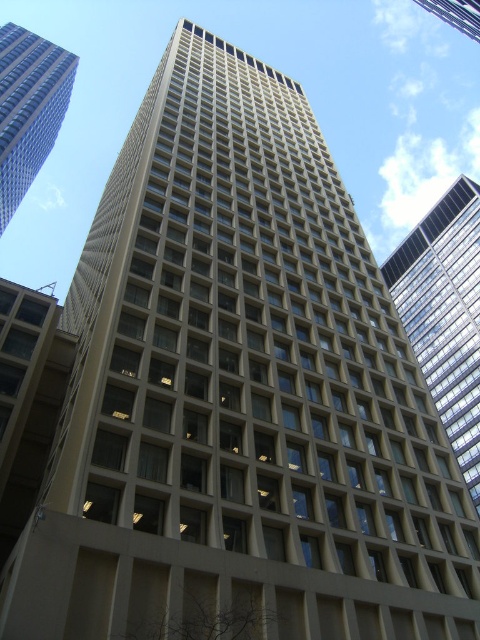
Is beige glass building at center shorter than beige glass building at upper center?

Incorrect, beige glass building at center's height does not fall short of beige glass building at upper center's.

Is beige glass building at center to the left of beige glass building at upper center from the viewer's perspective?

Indeed, beige glass building at center is positioned on the left side of beige glass building at upper center.

What do you see at coordinates (445, 314) in the screenshot? I see `beige glass building at center` at bounding box center [445, 314].

Where is `beige glass building at center`? This screenshot has height=640, width=480. beige glass building at center is located at coordinates (445, 314).

Is beige glass windows at lower left above beige concrete building at upper left?

No, beige glass windows at lower left is not above beige concrete building at upper left.

Between point (1, 548) and point (1, 35), which one is positioned behind?

Positioned behind is point (1, 35).

The width and height of the screenshot is (480, 640). Identify the location of beige glass windows at lower left. pos(27,400).

Is beige glass windows at lower left below beige glass building at upper center?

Yes, beige glass windows at lower left is below beige glass building at upper center.

Is point (38, 307) closer to viewer compared to point (468, 16)?

Yes, it is in front of point (468, 16).

Does point (7, 355) lie in front of point (444, 17)?

Yes.

Identify the location of beige glass windows at lower left. (27, 400).